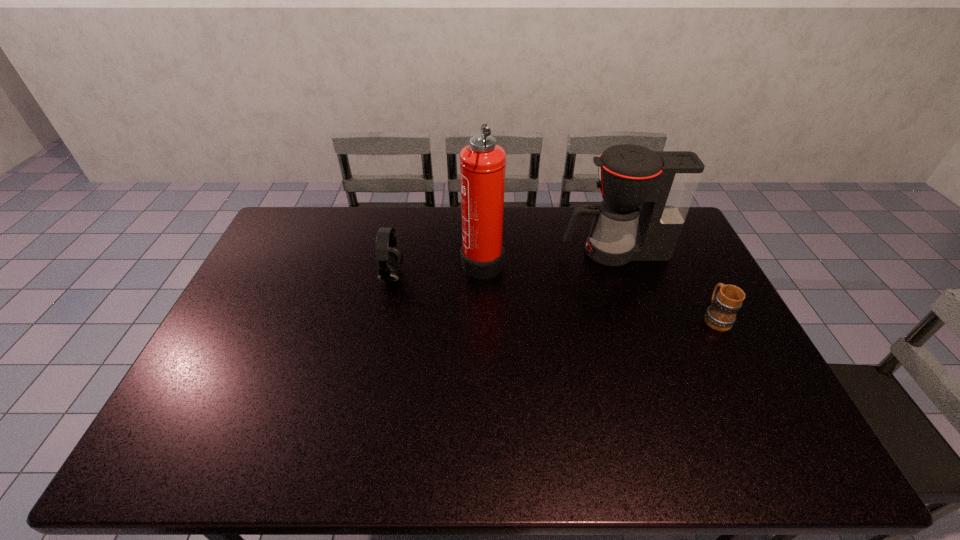
Locate an element on the screen. The width and height of the screenshot is (960, 540). vacant space situated 0.360m on the front-facing side of the second object from left to right is located at coordinates (356, 260).

Find the location of a particular element. blank area located pour from the carafe of the coffee maker is located at coordinates (524, 252).

Find the location of a particular element. vacant space located pour from the carafe of the coffee maker is located at coordinates (496, 252).

Find the location of a particular element. vacant region located 0.050m pour from the carafe of the coffee maker is located at coordinates (547, 252).

What are the coordinates of `free space located 0.070m on the ear cups of the second shortest object` in the screenshot? It's located at (423, 276).

Identify the location of free region located on the side of the nearest object with the handle. (695, 279).

Identify the location of blank space located 0.290m on the side of the nearest object with the handle. The height and width of the screenshot is (540, 960). (678, 245).

Find the location of `free space located 0.370m on the side of the nearest object with the handle`. free space located 0.370m on the side of the nearest object with the handle is located at coordinates (670, 232).

Where is `fire extinguisher at the far edge`? The height and width of the screenshot is (540, 960). fire extinguisher at the far edge is located at coordinates (482, 163).

The height and width of the screenshot is (540, 960). I want to click on coffee maker present at the far edge, so [664, 183].